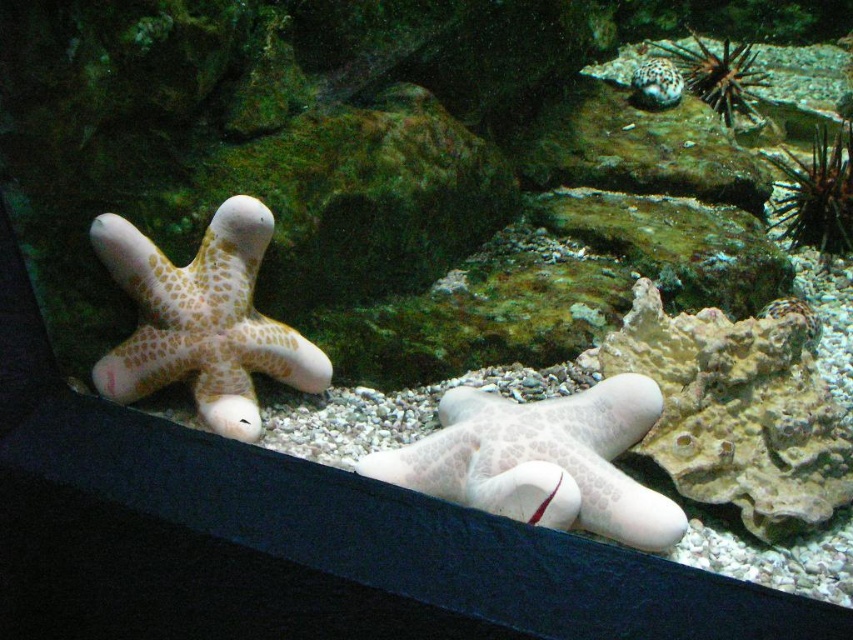
Question: Can you confirm if white matte starfish at center is positioned below sandy textured starfish at upper right?

Choices:
 (A) yes
 (B) no

Answer: (A)

Question: Which point is farther to the camera?

Choices:
 (A) (843, 129)
 (B) (143, 332)
 (C) (734, 74)
 (D) (415, 460)

Answer: (A)

Question: Does brown spiky sea urchin at right appear on the right side of sandy textured starfish at upper right?

Choices:
 (A) no
 (B) yes

Answer: (B)

Question: Based on their relative distances, which object is nearer to the sandy textured starfish at upper right?

Choices:
 (A) leathery beige starfish at left
 (B) speckled white starfish at upper right
 (C) white matte starfish at center
 (D) brown spiky sea urchin at right

Answer: (B)

Question: Can you confirm if white matte starfish at center is smaller than sandy textured starfish at upper right?

Choices:
 (A) no
 (B) yes

Answer: (A)

Question: Which object appears closest to the camera in this image?

Choices:
 (A) leathery beige starfish at left
 (B) brown spiky sea urchin at right

Answer: (A)